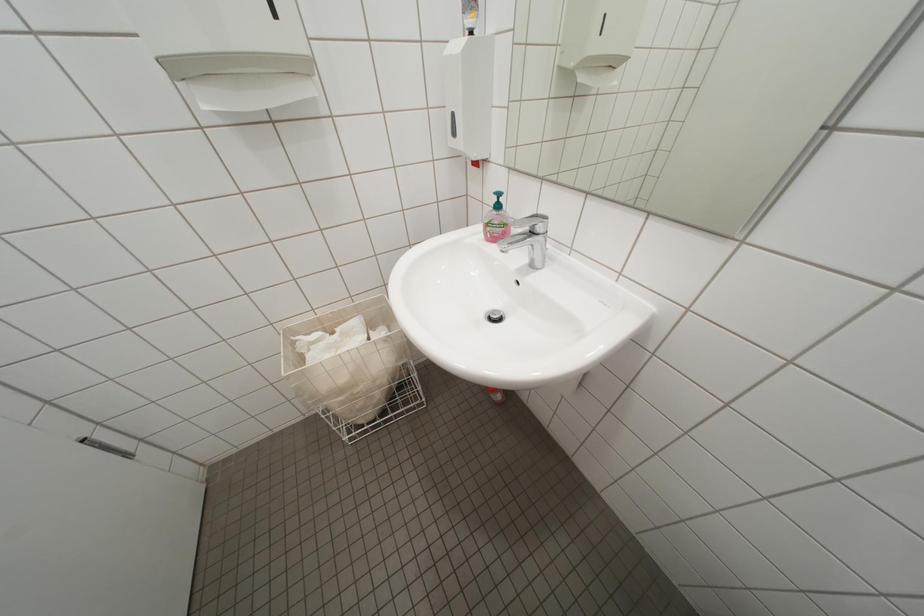
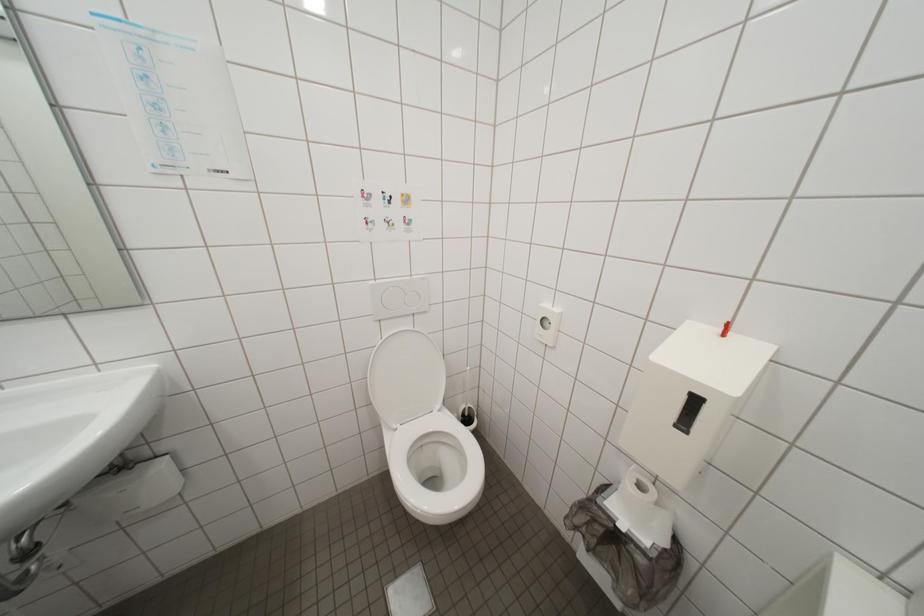
Based on the continuous images, in which direction is the camera rotating?

The camera rotated toward right-down.